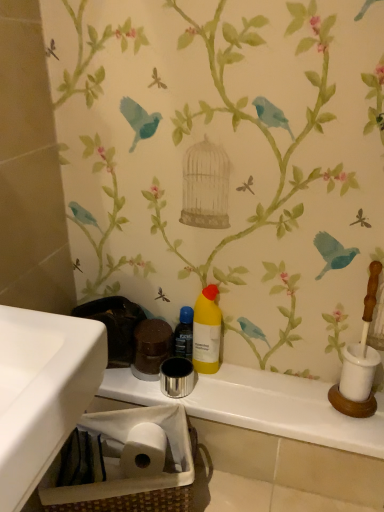
Find the location of a particular element. vacant area that lies to the right of yellow matte bottle at center is located at coordinates (263, 379).